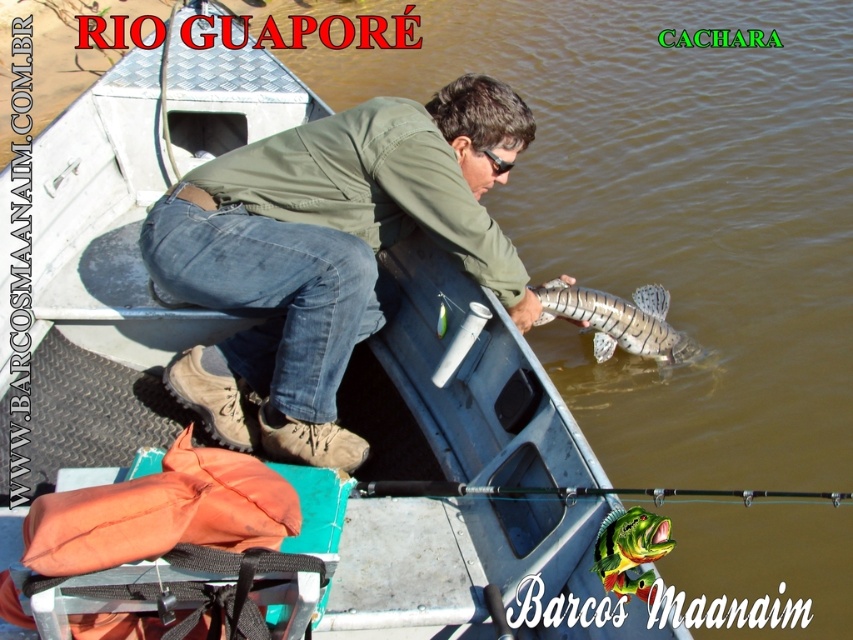
Question: Which of the following is the closest to the observer?

Choices:
 (A) pos(276,364)
 (B) pos(645,544)

Answer: (B)

Question: Which of these objects is positioned closest to the shiny silver fish at center?

Choices:
 (A) green matte jacket at center
 (B) green shiny fish at center

Answer: (A)

Question: Does shiny silver fish at center have a greater width compared to green shiny fish at center?

Choices:
 (A) yes
 (B) no

Answer: (A)

Question: Does green matte jacket at center appear on the left side of green shiny fish at center?

Choices:
 (A) no
 (B) yes

Answer: (B)

Question: Which object is positioned closest to the green shiny fish at center?

Choices:
 (A) shiny silver fish at center
 (B) green matte jacket at center

Answer: (B)

Question: In this image, where is black matte fishing pole at center located relative to green shiny fish at center?

Choices:
 (A) below
 (B) above

Answer: (B)